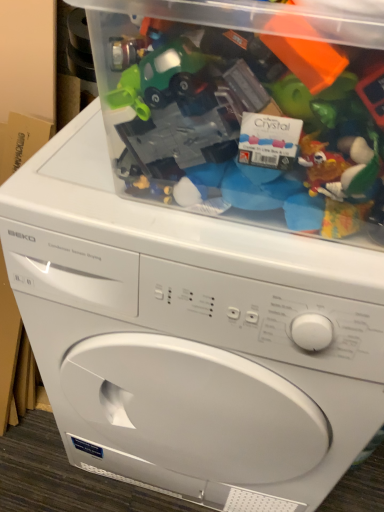
You are a GUI agent. You are given a task and a screenshot of the screen. Output one action in this format:
    pyautogui.click(x=<x>, y=<y>)
    Task: Click on the translucent plastic container at upper center
    The width and height of the screenshot is (384, 512).
    Given the screenshot: What is the action you would take?
    pyautogui.click(x=245, y=121)

Measure the distance between point (364, 99) and camera.

Point (364, 99) is 16.69 inches from camera.

What do you see at coordinates (245, 121) in the screenshot?
I see `translucent plastic container at upper center` at bounding box center [245, 121].

You are a GUI agent. You are given a task and a screenshot of the screen. Output one action in this format:
    pyautogui.click(x=<x>, y=<y>)
    Task: Click on the translucent plastic container at upper center
    
    Given the screenshot: What is the action you would take?
    pyautogui.click(x=245, y=121)